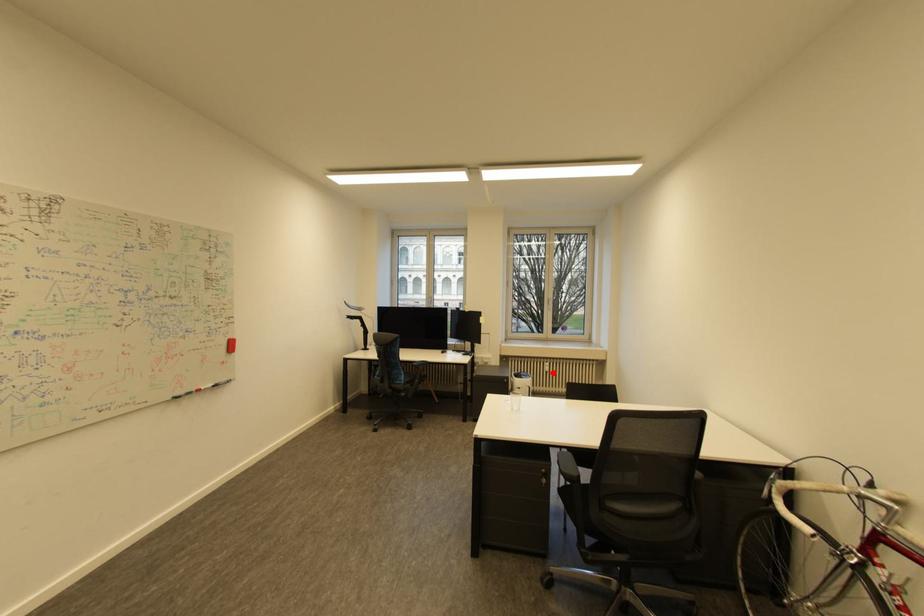
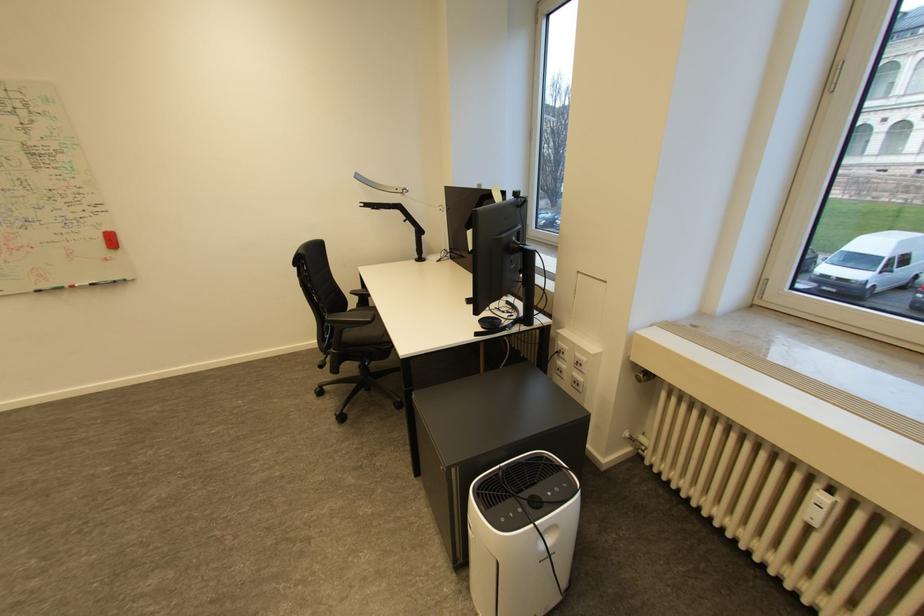
Locate, in the second image, the point that corresponds to the highlighted location in the first image.

(816, 525)